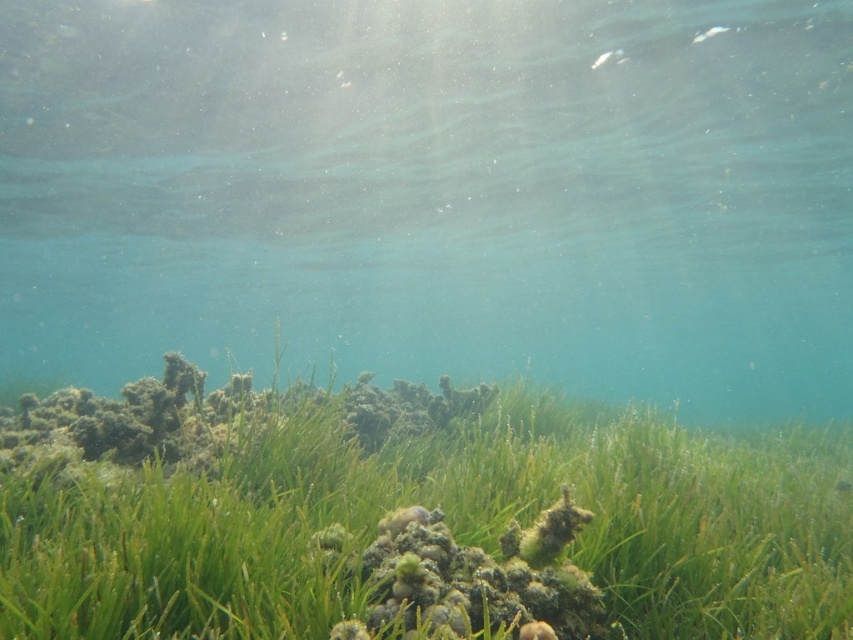
Between clear water at bottom and green matte grass at center, which one is positioned higher?

green matte grass at center

From the picture: Is the position of clear water at bottom more distant than that of green matte grass at center?

Yes, it is behind green matte grass at center.

Between point (318, 4) and point (583, 452), which one is positioned in front?

Point (583, 452)

Where is `clear water at bottom`? This screenshot has width=853, height=640. clear water at bottom is located at coordinates pos(436,192).